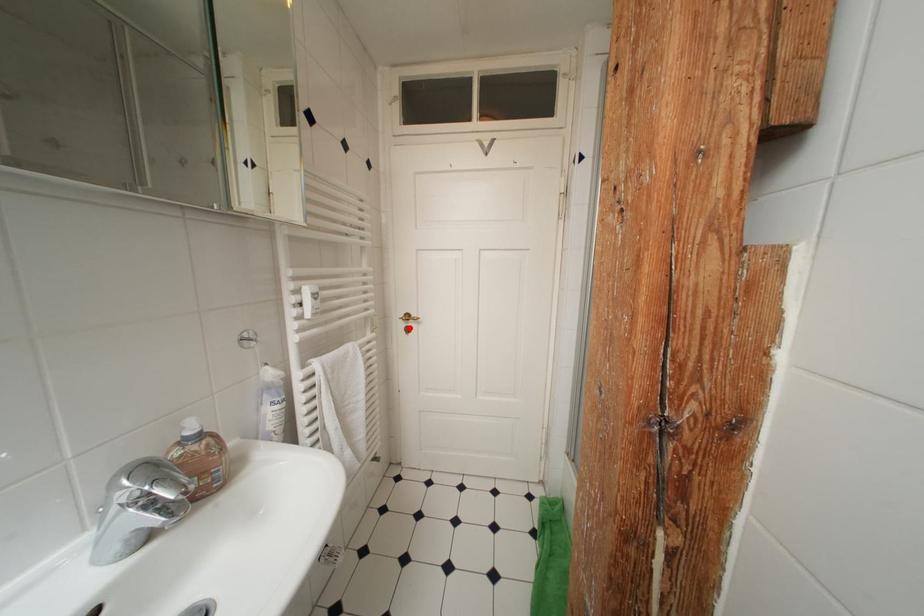
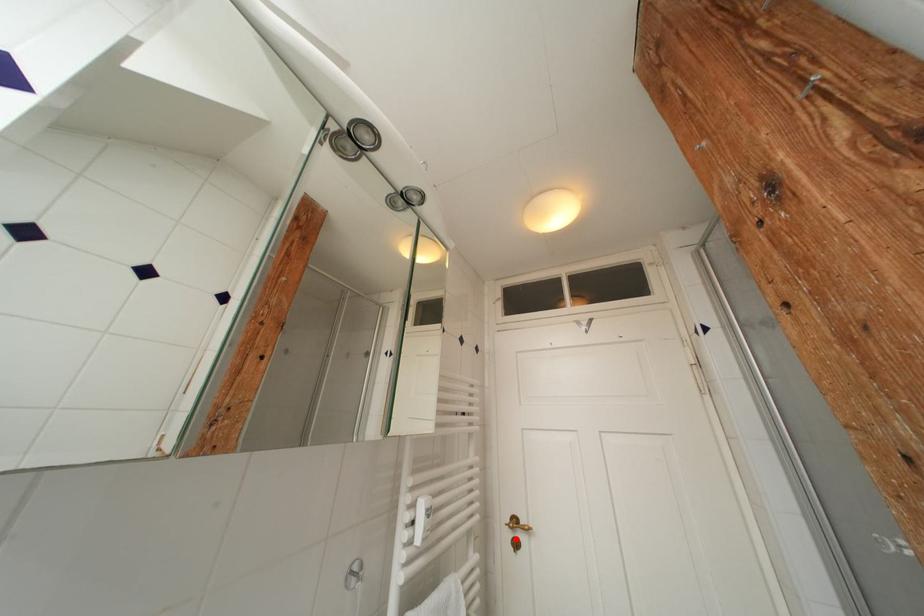
I am providing you with two images of the same scene from different viewpoints. A red point is marked on the first image and another point is marked on the second image. Are the points marked in image1 and image2 representing the same 3D position?

Yes